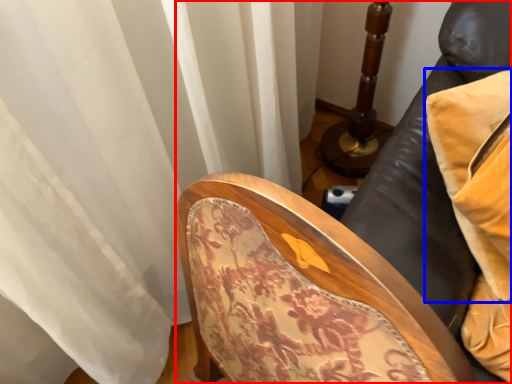
Question: Which of the following is the farthest to the observer, furniture (highlighted by a red box) or pillow (highlighted by a blue box)?

Choices:
 (A) furniture
 (B) pillow

Answer: (B)